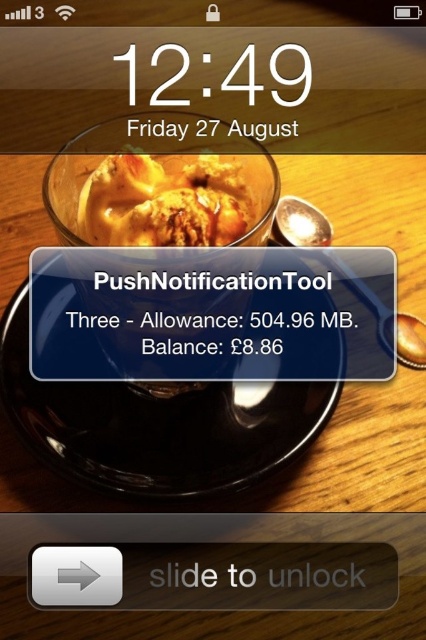
Question: Is black glossy plate at center to the left of golden brown crumbly pastry at upper center from the viewer's perspective?

Choices:
 (A) yes
 (B) no

Answer: (A)

Question: Is black glossy plate at center thinner than golden brown crumbly pastry at upper center?

Choices:
 (A) yes
 (B) no

Answer: (B)

Question: Which of the following is the farthest from the observer?

Choices:
 (A) (83, 404)
 (B) (97, 237)

Answer: (A)

Question: Which of the following is the farthest from the observer?

Choices:
 (A) (91, 454)
 (B) (123, 170)

Answer: (A)

Question: Which object appears closest to the camera in this image?

Choices:
 (A) black glossy plate at center
 (B) golden brown crumbly pastry at upper center

Answer: (B)

Question: Does black glossy plate at center have a greater width compared to golden brown crumbly pastry at upper center?

Choices:
 (A) yes
 (B) no

Answer: (A)